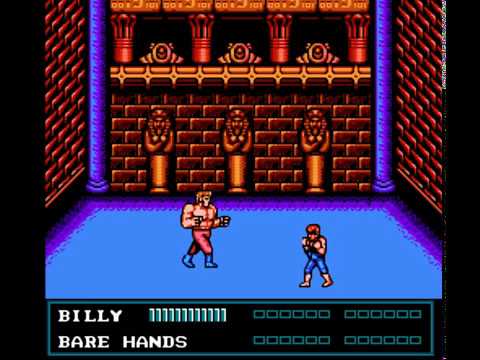
This screenshot has height=360, width=480. What are the coordinates of `columns` in the screenshot? It's located at (95, 98), (382, 100).